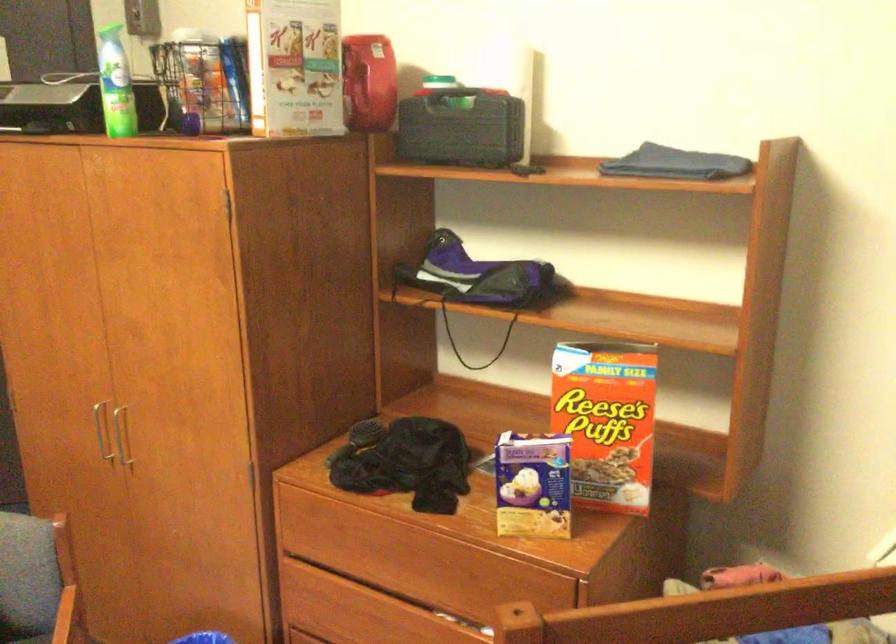
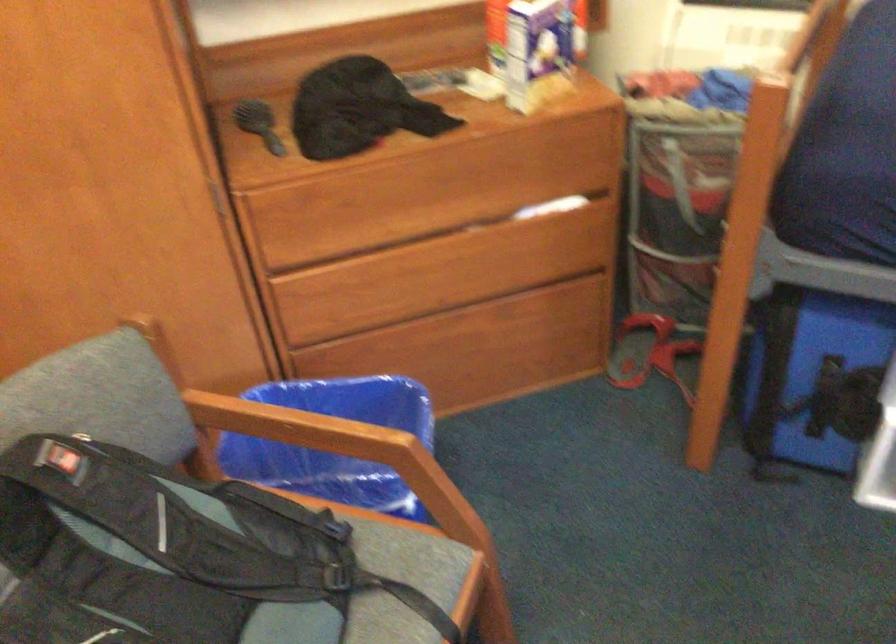
Where in the second image is the point corresponding to point 517,480 from the first image?

(531, 50)